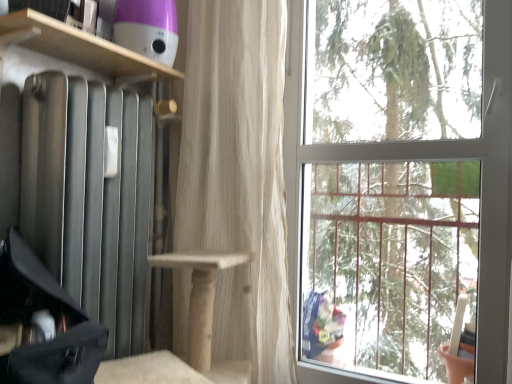
Question: From the image's perspective, is black fabric suitcase at left located beneath wooden shelf at upper left?

Choices:
 (A) no
 (B) yes

Answer: (B)

Question: Is black fabric suitcase at left facing away from wooden shelf at upper left?

Choices:
 (A) no
 (B) yes

Answer: (A)

Question: Does black fabric suitcase at left have a greater width compared to wooden shelf at upper left?

Choices:
 (A) no
 (B) yes

Answer: (B)

Question: Is wooden shelf at upper left surrounded by black fabric suitcase at left?

Choices:
 (A) yes
 (B) no

Answer: (B)

Question: Does black fabric suitcase at left have a lesser height compared to wooden shelf at upper left?

Choices:
 (A) no
 (B) yes

Answer: (A)

Question: Is black fabric suitcase at left to the left of wooden shelf at upper left from the viewer's perspective?

Choices:
 (A) no
 (B) yes

Answer: (B)

Question: Does transparent glass window at upper right come in front of wooden shelf at upper left?

Choices:
 (A) yes
 (B) no

Answer: (B)

Question: Considering the relative positions of transparent glass window at upper right and wooden shelf at upper left in the image provided, is transparent glass window at upper right behind wooden shelf at upper left?

Choices:
 (A) no
 (B) yes

Answer: (B)

Question: Can you confirm if transparent glass window at upper right is thinner than wooden shelf at upper left?

Choices:
 (A) no
 (B) yes

Answer: (B)

Question: From the image's perspective, is transparent glass window at upper right on top of wooden shelf at upper left?

Choices:
 (A) yes
 (B) no

Answer: (B)

Question: From a real-world perspective, is transparent glass window at upper right on wooden shelf at upper left?

Choices:
 (A) no
 (B) yes

Answer: (A)

Question: Considering the relative sizes of transparent glass window at upper right and wooden shelf at upper left in the image provided, is transparent glass window at upper right shorter than wooden shelf at upper left?

Choices:
 (A) yes
 (B) no

Answer: (B)

Question: From the image's perspective, does black fabric suitcase at left appear higher than transparent glass window at upper right?

Choices:
 (A) no
 (B) yes

Answer: (A)